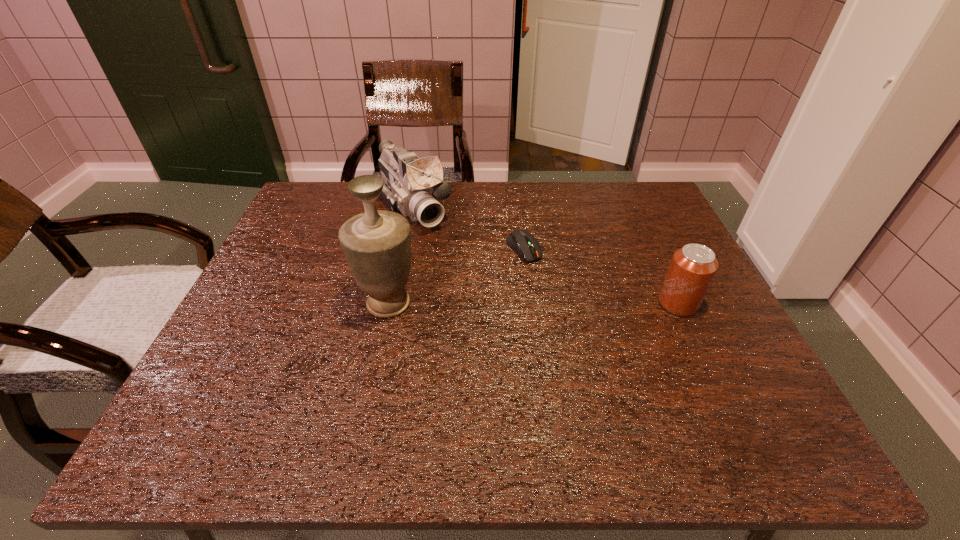
Locate an element on the screen. Image resolution: width=960 pixels, height=540 pixels. vacant space on the desktop that is between the urn and the third tallest object and is positioned on the front-facing side of the second tallest object is located at coordinates (496, 303).

What are the coordinates of `free space on the desktop that is between the tallest object and the rightmost object and is positioned on the button of the computer equipment` in the screenshot? It's located at (567, 303).